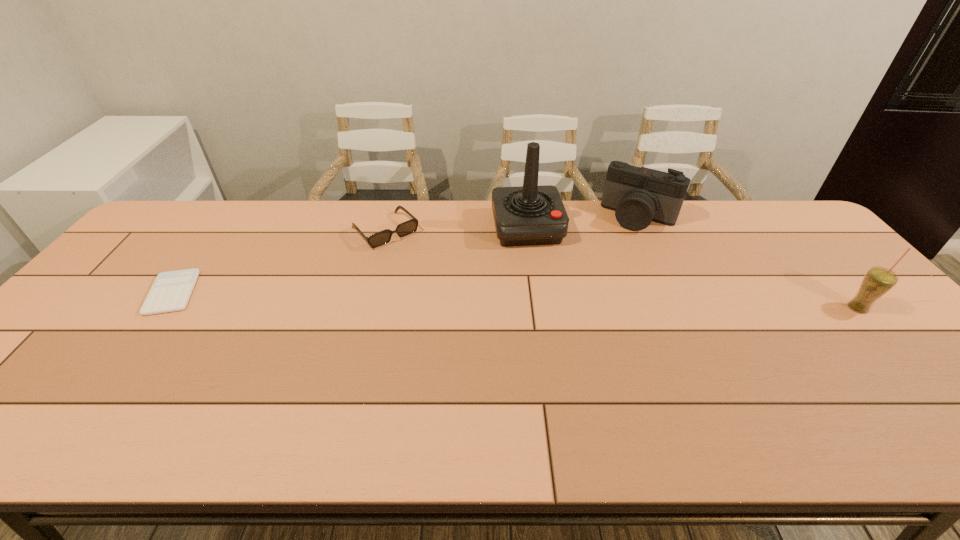
Where is `free region at the far right corner of the desktop`? free region at the far right corner of the desktop is located at coordinates (817, 238).

Identify the location of vacant area that lies between the calculator and the rightmost object. This screenshot has width=960, height=540. (516, 300).

You are a GUI agent. You are given a task and a screenshot of the screen. Output one action in this format:
    pyautogui.click(x=<x>, y=<y>)
    Task: Click on the vacant space that's between the fourth object from left to right and the straw for drinking
    The height and width of the screenshot is (540, 960).
    Given the screenshot: What is the action you would take?
    pyautogui.click(x=749, y=262)

Find the location of a particular element. vacant area that lies between the second shortest object and the shortest object is located at coordinates (279, 261).

Find the location of a particular element. vacant space that's between the third object from right to left and the fourth object from right to left is located at coordinates (456, 230).

Locate an element on the screen. This screenshot has height=540, width=960. free point between the joystick and the straw for drinking is located at coordinates (692, 268).

Where is `empty location between the camera and the tallest object`? The height and width of the screenshot is (540, 960). empty location between the camera and the tallest object is located at coordinates click(x=584, y=222).

The height and width of the screenshot is (540, 960). I want to click on unoccupied area between the straw for drinking and the joystick, so click(692, 268).

You are a GUI agent. You are given a task and a screenshot of the screen. Output one action in this format:
    pyautogui.click(x=<x>, y=<y>)
    Task: Click on the vacant region between the camera and the calculator
    
    Given the screenshot: What is the action you would take?
    pyautogui.click(x=406, y=255)

I want to click on free space that is in between the rightmost object and the leftmost object, so click(x=516, y=300).